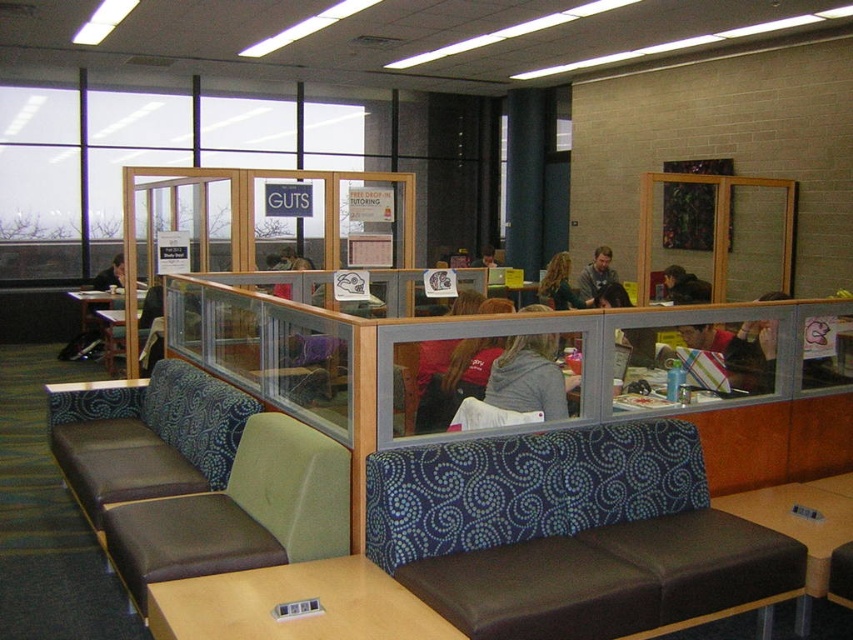
Question: Which of the following is the closest to the observer?

Choices:
 (A) (71, 404)
 (B) (790, 531)

Answer: (B)

Question: Is brown leather bench at center bigger than brown leather couch at center?

Choices:
 (A) no
 (B) yes

Answer: (A)

Question: Based on their relative distances, which object is nearer to the gray knit sweater at center?

Choices:
 (A) smooth brown table at lower right
 (B) brown leather couch at center
 (C) smooth brown table at lower center

Answer: (A)

Question: From the image, what is the correct spatial relationship of wooden table at center in relation to matte gray sweater at center?

Choices:
 (A) left
 (B) right

Answer: (B)

Question: Is brown leather couch at center closer to the viewer compared to smooth brown table at lower center?

Choices:
 (A) yes
 (B) no

Answer: (B)

Question: Among these objects, which one is nearest to the camera?

Choices:
 (A) brown leather table at center
 (B) smooth brown table at lower center

Answer: (B)